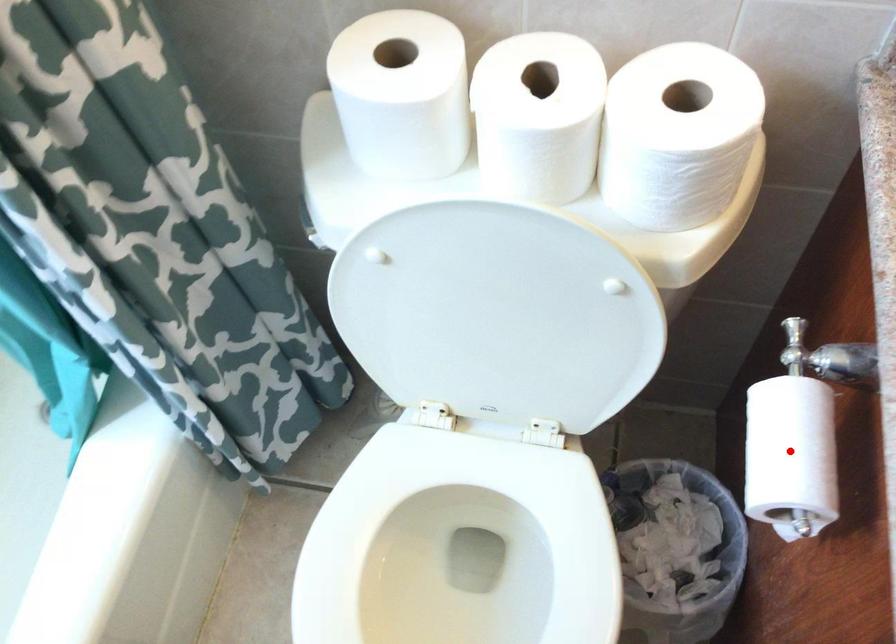
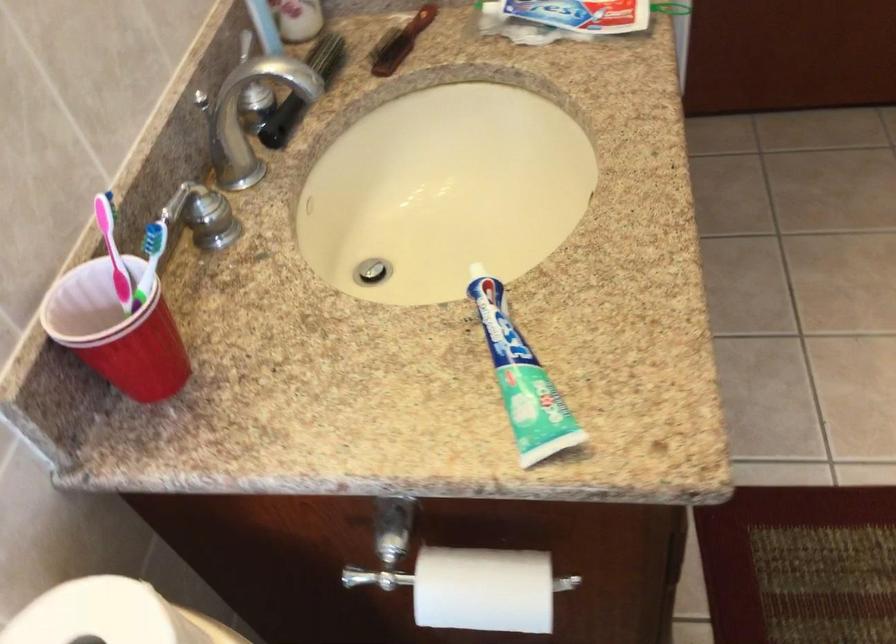
Locate, in the second image, the point that corresponds to the highlighted location in the first image.

(483, 589)